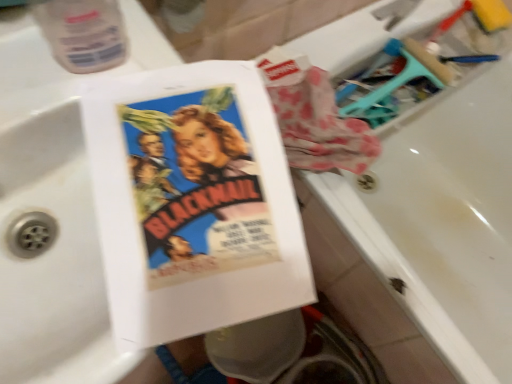
Image resolution: width=512 pixels, height=384 pixels. I want to click on free space above matte paper book at center (from a real-world perspective), so click(x=117, y=141).